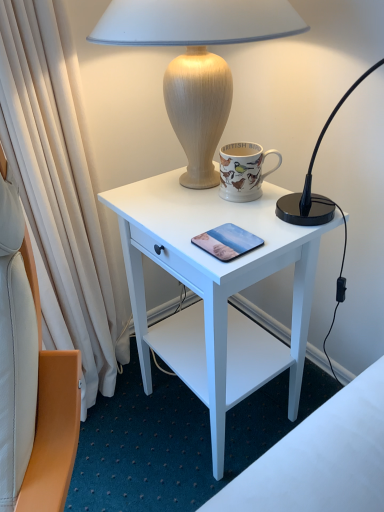
Question: Is porcelain mug with colorful birds at upper center not near white matte desk at center?

Choices:
 (A) no
 (B) yes

Answer: (A)

Question: Can you confirm if porcelain mug with colorful birds at upper center is thinner than white matte desk at center?

Choices:
 (A) no
 (B) yes

Answer: (B)

Question: From the image's perspective, does porcelain mug with colorful birds at upper center appear higher than white matte desk at center?

Choices:
 (A) no
 (B) yes

Answer: (B)

Question: Considering the relative sizes of porcelain mug with colorful birds at upper center and white matte desk at center in the image provided, is porcelain mug with colorful birds at upper center smaller than white matte desk at center?

Choices:
 (A) no
 (B) yes

Answer: (B)

Question: Considering the relative positions of porcelain mug with colorful birds at upper center and white matte desk at center in the image provided, is porcelain mug with colorful birds at upper center to the left of white matte desk at center from the viewer's perspective?

Choices:
 (A) no
 (B) yes

Answer: (A)

Question: Looking at their shapes, would you say matte glass pad at center is wider or thinner than wooden lamp at upper center?

Choices:
 (A) thin
 (B) wide

Answer: (A)

Question: Considering their positions, is matte glass pad at center located in front of or behind wooden lamp at upper center?

Choices:
 (A) front
 (B) behind

Answer: (B)

Question: Looking at the image, does matte glass pad at center seem bigger or smaller compared to wooden lamp at upper center?

Choices:
 (A) small
 (B) big

Answer: (A)

Question: From a real-world perspective, relative to wooden lamp at upper center, is matte glass pad at center vertically above or below?

Choices:
 (A) below
 (B) above

Answer: (A)

Question: From the image's perspective, is porcelain mug with colorful birds at upper center located above or below matte glass pad at center?

Choices:
 (A) above
 (B) below

Answer: (A)

Question: Is porcelain mug with colorful birds at upper center wider or thinner than matte glass pad at center?

Choices:
 (A) wide
 (B) thin

Answer: (B)

Question: In terms of height, does porcelain mug with colorful birds at upper center look taller or shorter compared to matte glass pad at center?

Choices:
 (A) tall
 (B) short

Answer: (A)

Question: From a real-world perspective, is porcelain mug with colorful birds at upper center above or below matte glass pad at center?

Choices:
 (A) below
 (B) above

Answer: (B)

Question: In the image, is wooden lamp at upper center positioned in front of or behind white matte desk at center?

Choices:
 (A) behind
 (B) front

Answer: (B)

Question: Is wooden lamp at upper center wider or thinner than white matte desk at center?

Choices:
 (A) wide
 (B) thin

Answer: (A)